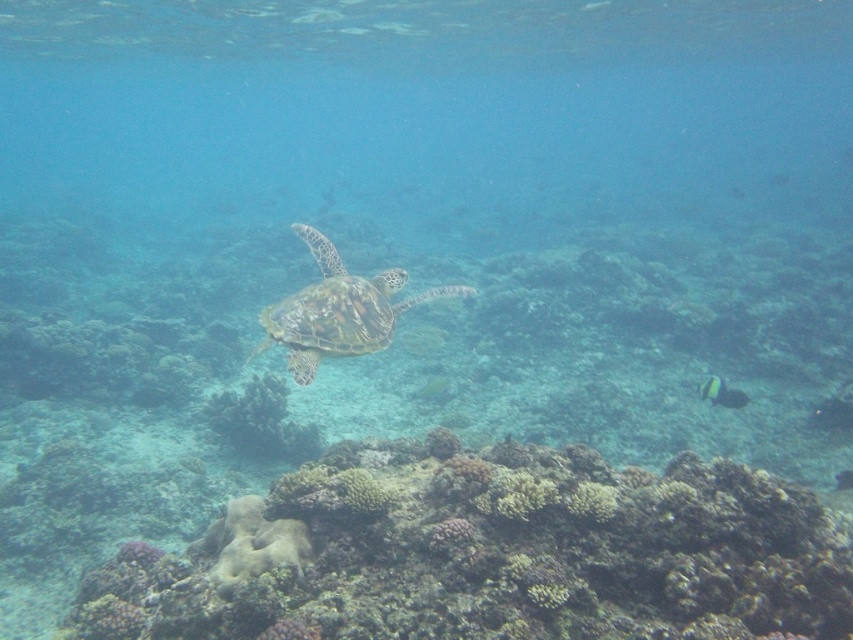
You are a marine biologist studying underwater formations. You observe a green textured coral at center in the image. What are its coordinates in the image?

The green textured coral at center is located at coordinates point (260, 420).

You are a scuba diver at the surface of the ocean. You see the green textured coral at center. Can you reach it by diving straight down without moving horizontally?

The green textured coral at center is 6.56 meters away from viewer, so yes, you can reach it by diving straight down since it is directly below you at that depth.

You are a scuba diver wearing a 1.5 meter long diving tank. You are currently hovering above the rough textured coral reef at center. Can you safely move closer to the reef without hitting your tank on it?

The distance between you and the rough textured coral reef at center is 1.85 meters, which is greater than the length of your diving tank. Therefore, you can safely move closer to the reef without hitting your tank on it.